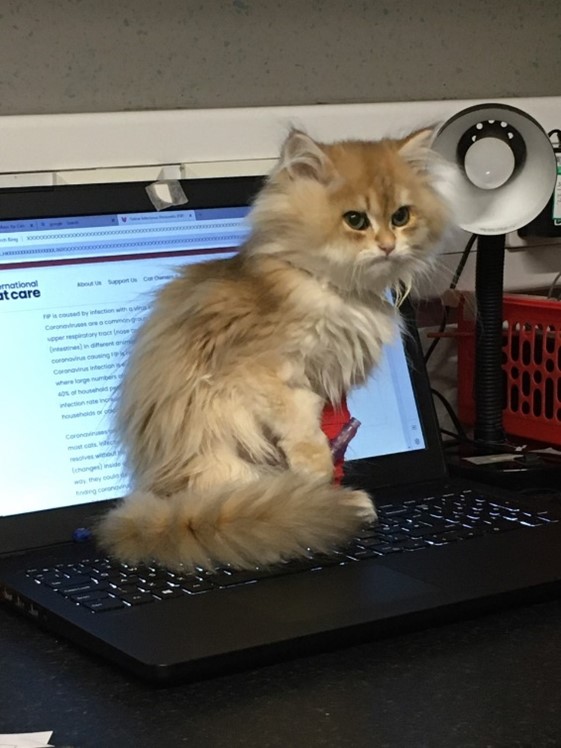
Where is `tape placed over computer camera`? The height and width of the screenshot is (748, 561). tape placed over computer camera is located at coordinates (169, 190).